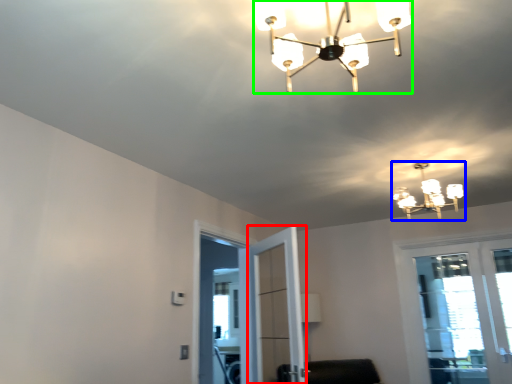
Question: Which is nearer to the screen door (highlighted by a red box)? lamp (highlighted by a blue box) or lamp (highlighted by a green box).

Choices:
 (A) lamp
 (B) lamp

Answer: (A)